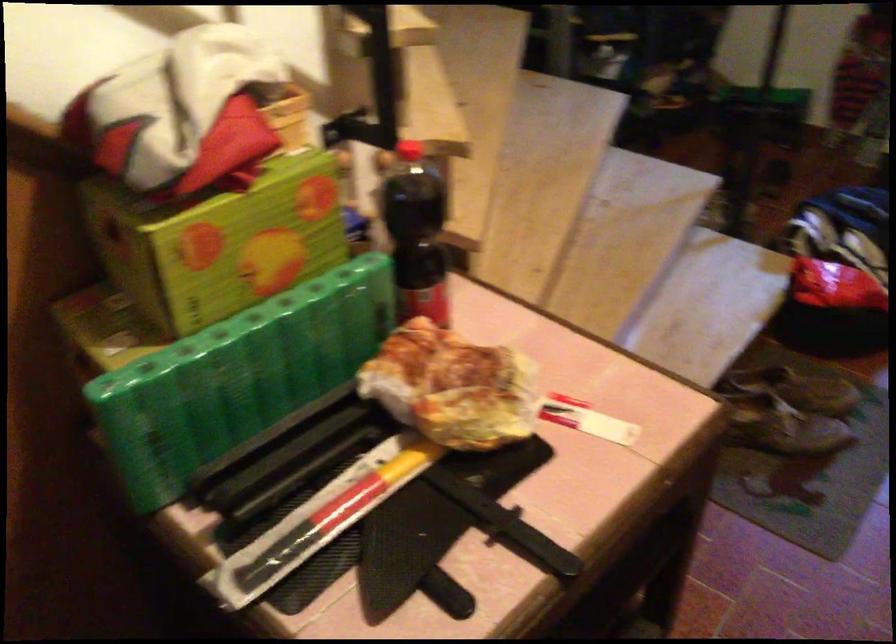
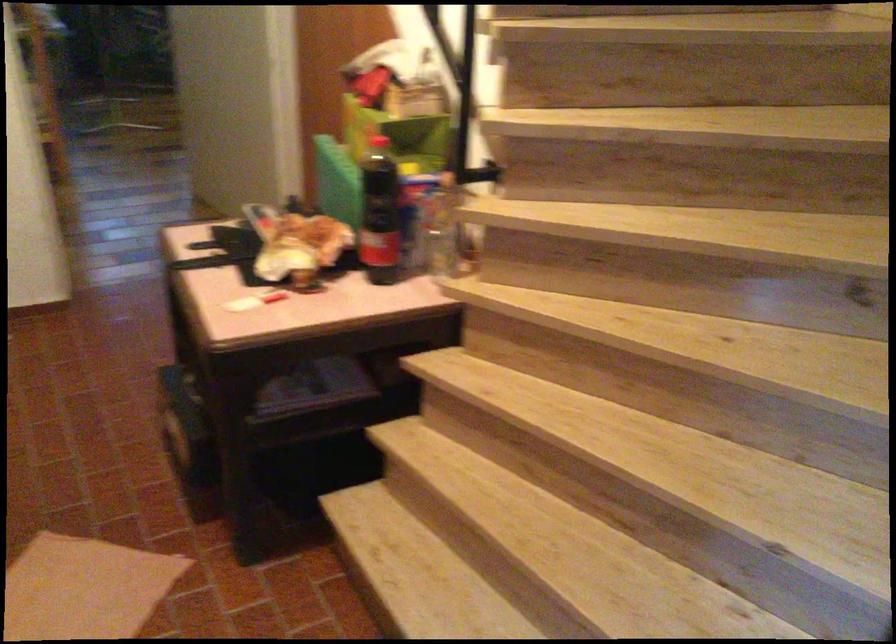
Where in the second image is the point corresponding to point (524, 415) from the first image?

(280, 292)